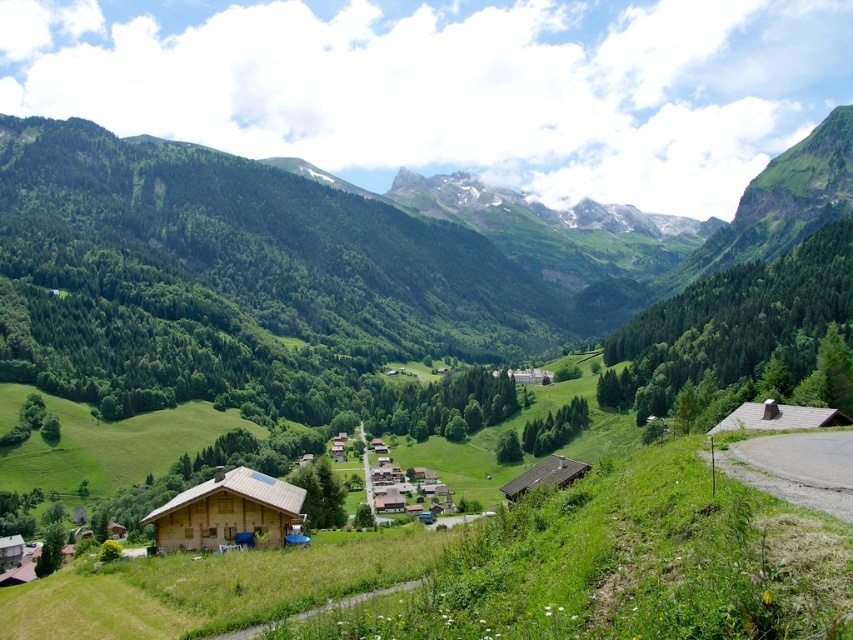
Does wooden houses at center have a larger size compared to brown wooden hut at lower right?

Incorrect, wooden houses at center is not larger than brown wooden hut at lower right.

Consider the image. Which of these two, wooden houses at center or brown wooden hut at lower right, stands taller?

With more height is brown wooden hut at lower right.

At what (x,y) coordinates should I click in order to perform the action: click on wooden houses at center. Please return your answer as a coordinate pair (x, y). This screenshot has height=640, width=853. Looking at the image, I should click on (399, 486).

I want to click on wooden houses at center, so click(399, 486).

Does wooden houses at center come behind green grassy path at lower center?

Yes, wooden houses at center is further from the viewer.

Between point (395, 474) and point (251, 632), which one is positioned behind?

The point (395, 474) is more distant.

Locate an element on the screen. This screenshot has width=853, height=640. wooden houses at center is located at coordinates (399, 486).

Is wooden cabin at lower right bigger than wooden cabin at center?

Yes.

What are the coordinates of `wooden cabin at lower right` in the screenshot? It's located at (544, 476).

Image resolution: width=853 pixels, height=640 pixels. Describe the element at coordinates (544, 476) in the screenshot. I see `wooden cabin at lower right` at that location.

The width and height of the screenshot is (853, 640). I want to click on wooden cabin at lower right, so click(544, 476).